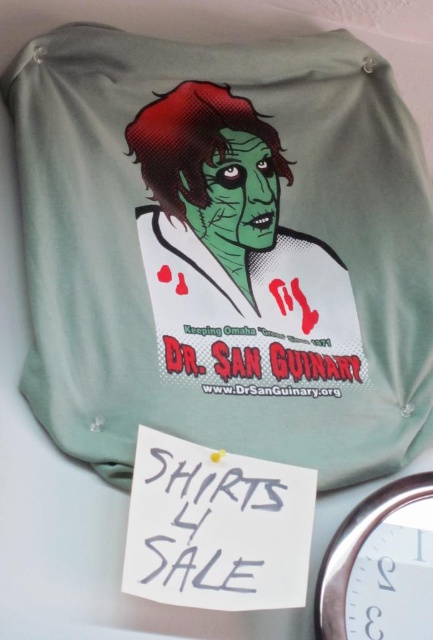
What are the coordinates of the matte green fabric lab coat at center in the image?

The coordinates of the matte green fabric lab coat at center are at point [223,250].

You are a customer at a clothing store looking to buy a lab coat. You see the matte green fabric lab coat at center and the white plastic clock at lower right. Which item is larger in size?

The matte green fabric lab coat at center is bigger than the white plastic clock at lower right.

You are a tailor who needs to know if the matte green fabric lab coat at center can be folded and placed inside the white plastic clock at lower right. Based on their sizes, what do you think?

The matte green fabric lab coat at center has a larger width than the white plastic clock at lower right, so it cannot be folded and placed inside the white plastic clock at lower right.